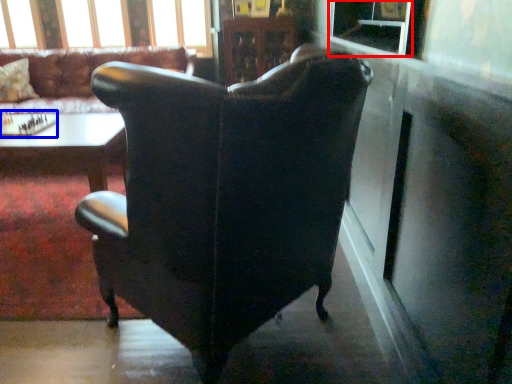
Question: Which of the following is the farthest to the observer, window screen (highlighted by a red box) or board game (highlighted by a blue box)?

Choices:
 (A) window screen
 (B) board game

Answer: (B)